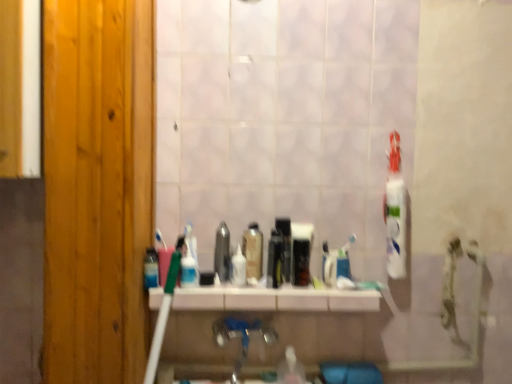
Question: Would you say blue metallic faucet at center is to the left or to the right of black glossy mouthwash at center, acting as the 8th mouthwash starting from the left, in the picture?

Choices:
 (A) left
 (B) right

Answer: (A)

Question: Considering the positions of blue metallic faucet at center and black glossy mouthwash at center, acting as the 8th mouthwash starting from the left, in the image, is blue metallic faucet at center bigger or smaller than black glossy mouthwash at center, acting as the 8th mouthwash starting from the left,?

Choices:
 (A) big
 (B) small

Answer: (A)

Question: Considering the real-world distances, which object is farthest from the metallic silver mouthwash at center, which is counted as the third mouthwash, starting from the left?

Choices:
 (A) white glossy shelf at center
 (B) black plastic mouthwash at center, which appears as the seventh mouthwash when viewed from the left
 (C) translucent plastic mouthwash at center, placed as the 6th mouthwash when sorted from left to right
 (D) white plastic toothbrush at center
 (E) blue glossy bottle at center, which ranks as the eighth mouthwash in right-to-left order

Answer: (D)

Question: Estimate the real-world distances between objects in this image. Which object is farther from the translucent plastic mouthwash at center, which appears as the fifth mouthwash when viewed from the right?

Choices:
 (A) metallic silver mouthwash at center, which is counted as the third mouthwash, starting from the left
 (B) white glossy shelf at center
 (C) black plastic mouthwash at center, which appears as the seventh mouthwash when viewed from the left
 (D) translucent plastic mouthwash at center, placed as the 6th mouthwash when sorted from left to right
 (E) translucent plastic mouthwash at center, the 2th mouthwash positioned from the left

Answer: (B)